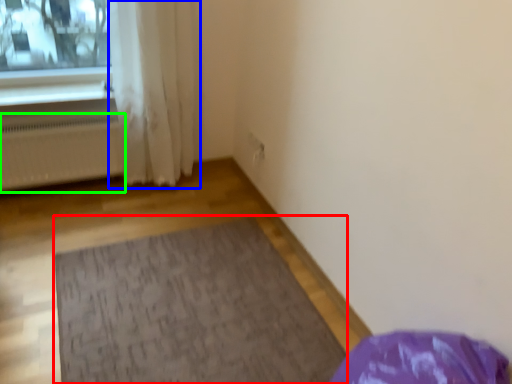
Question: Which is nearer to the mat (highlighted by a red box)? curtain (highlighted by a blue box) or radiator (highlighted by a green box).

Choices:
 (A) curtain
 (B) radiator

Answer: (A)